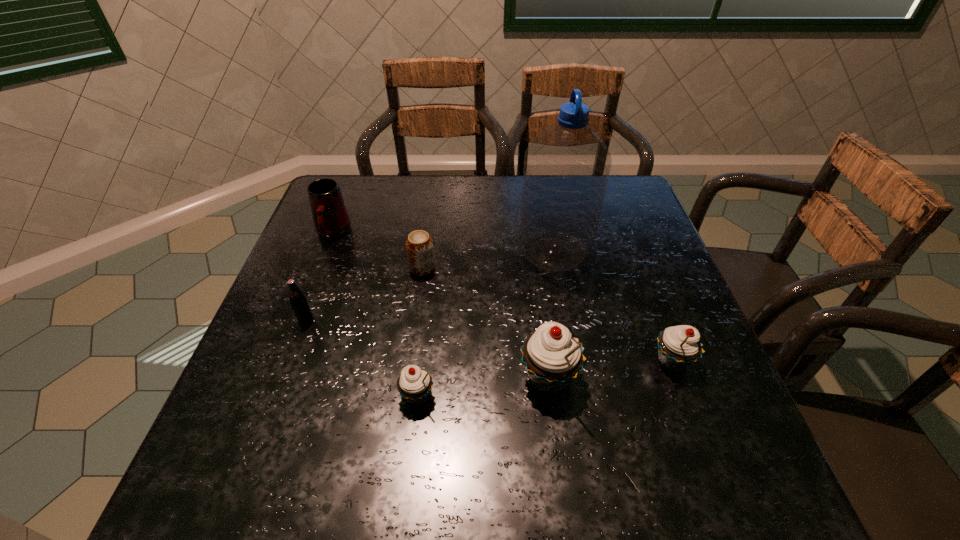
The image size is (960, 540). What are the coordinates of `object that is at the far left corner` in the screenshot? It's located at (331, 220).

This screenshot has width=960, height=540. What are the coordinates of `vacant space at the far edge of the desktop` in the screenshot? It's located at click(x=499, y=180).

Find the location of a particular element. The height and width of the screenshot is (540, 960). vacant area at the near edge of the desktop is located at coordinates pos(594,424).

The height and width of the screenshot is (540, 960). In the image, there is a desktop. Identify the location of blank space at the left edge. [326, 256].

In the image, there is a desktop. Where is `vacant area at the right edge`? vacant area at the right edge is located at coordinates (630, 307).

The height and width of the screenshot is (540, 960). In the image, there is a desktop. What are the coordinates of `vacant space at the near left corner` in the screenshot? It's located at click(308, 397).

Identify the location of blank space at the far right corner of the desktop. (617, 186).

Locate an element on the screen. This screenshot has height=540, width=960. vacant region between the beer can and the second tallest object is located at coordinates (486, 323).

This screenshot has width=960, height=540. What are the coordinates of `vacant region between the second tallest object and the water jug` in the screenshot? It's located at (551, 315).

Locate an element on the screen. unoccupied area between the beer can and the leftmost cupcake is located at coordinates (420, 332).